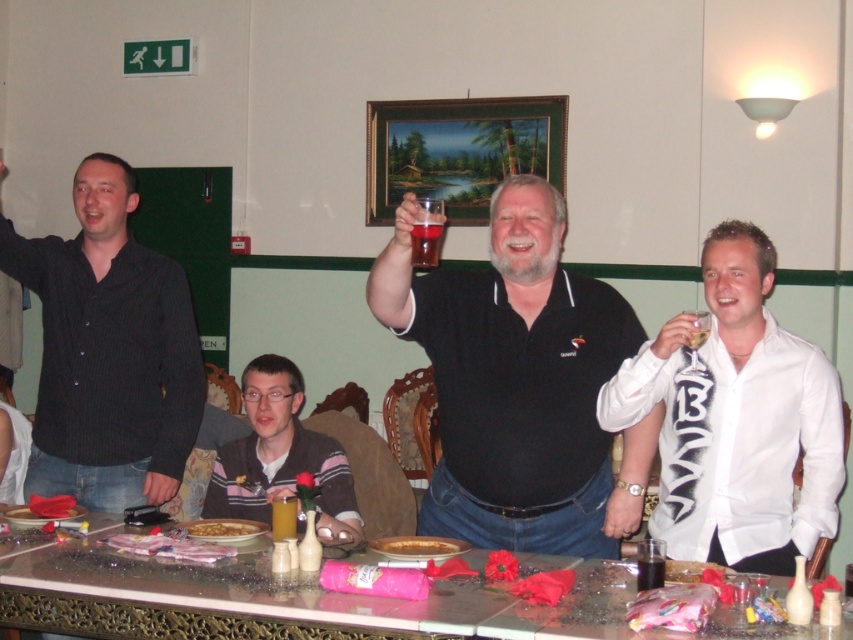
Question: Which object is closer to the camera taking this photo?

Choices:
 (A) brown matte nuts at center
 (B) translucent plastic cup at center

Answer: (B)

Question: Based on their relative distances, which object is nearer to the black pinstripe shirt at left?

Choices:
 (A) black matte shirt at center
 (B) brown matte nuts at center
 (C) translucent glass at center

Answer: (B)

Question: Which point is farther to the camera?

Choices:
 (A) (206, 528)
 (B) (274, 403)
 (C) (780, 477)
 (D) (442, 221)

Answer: (B)

Question: Is golden flaky pie at center above translucent glass at center?

Choices:
 (A) no
 (B) yes

Answer: (A)

Question: Is translucent glass table at center to the right of golden flaky pie at center from the viewer's perspective?

Choices:
 (A) no
 (B) yes

Answer: (A)

Question: Does striped sweater at lower center appear on the right side of brown matte nuts at center?

Choices:
 (A) no
 (B) yes

Answer: (B)